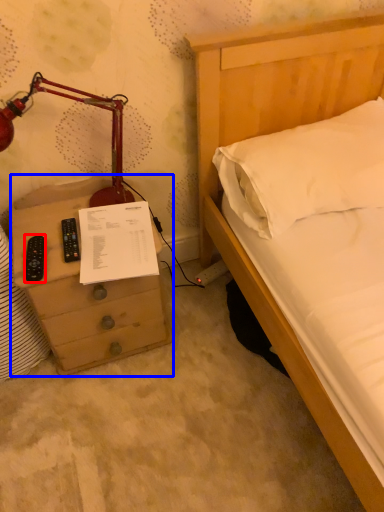
Question: Which object appears farthest to the camera in this image, remote (highlighted by a red box) or chest of drawers (highlighted by a blue box)?

Choices:
 (A) remote
 (B) chest of drawers

Answer: (A)